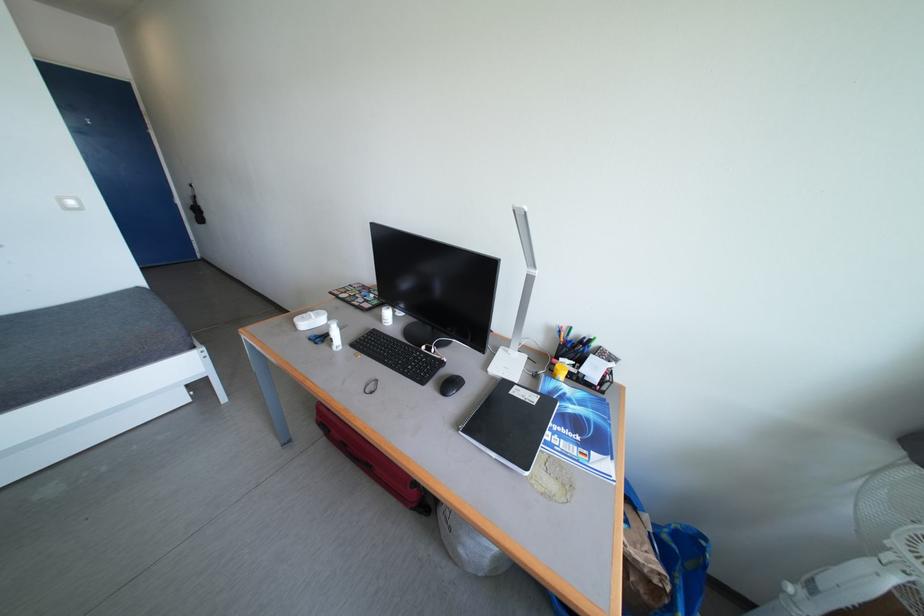
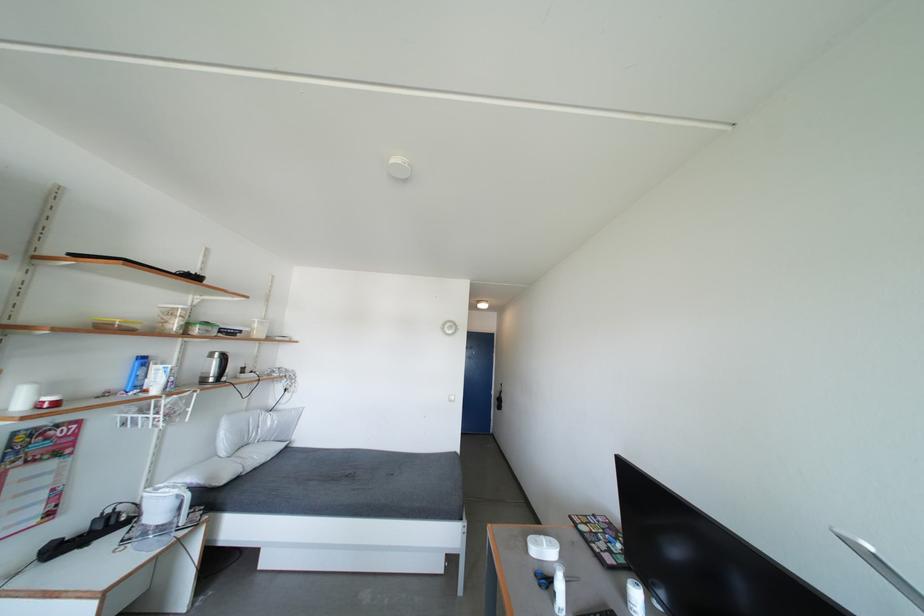
First-person continuous shooting, in which direction is the camera rotating?

The camera rotated toward left-up.